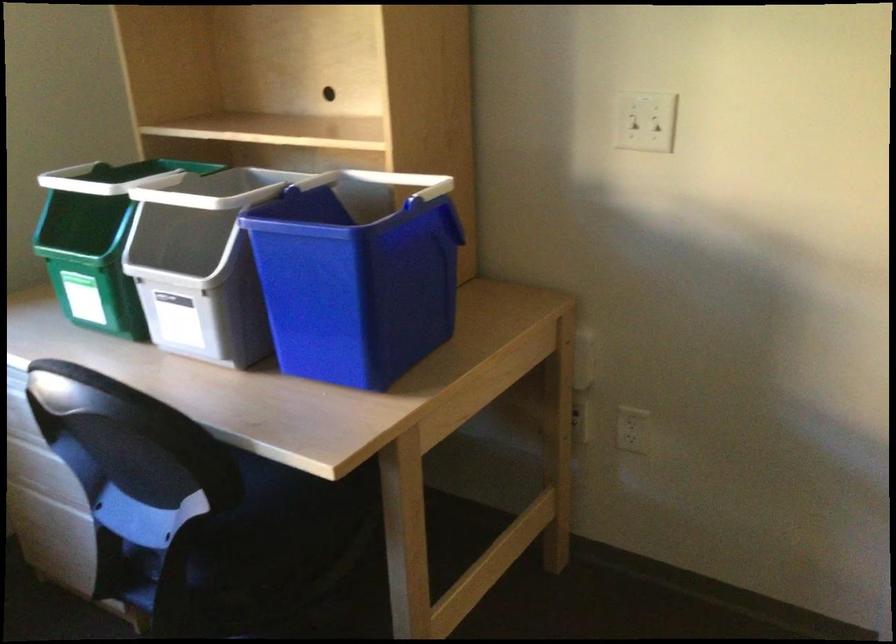
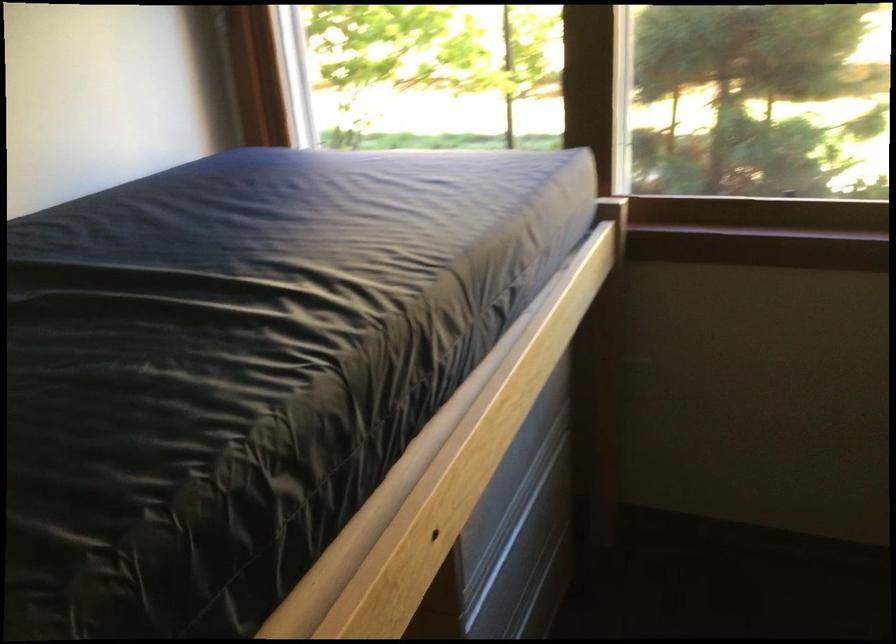
How did the camera likely rotate?

The camera rotated toward left-down.